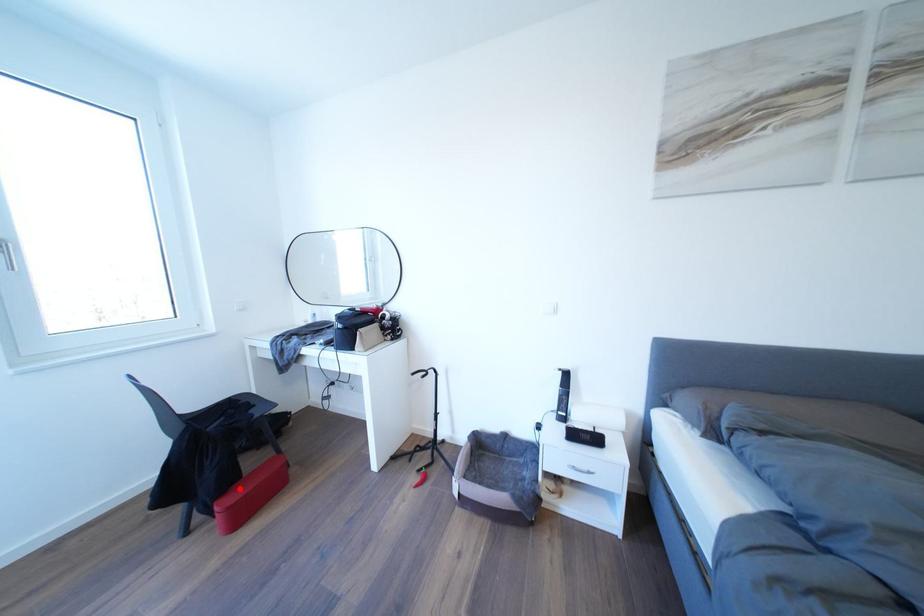
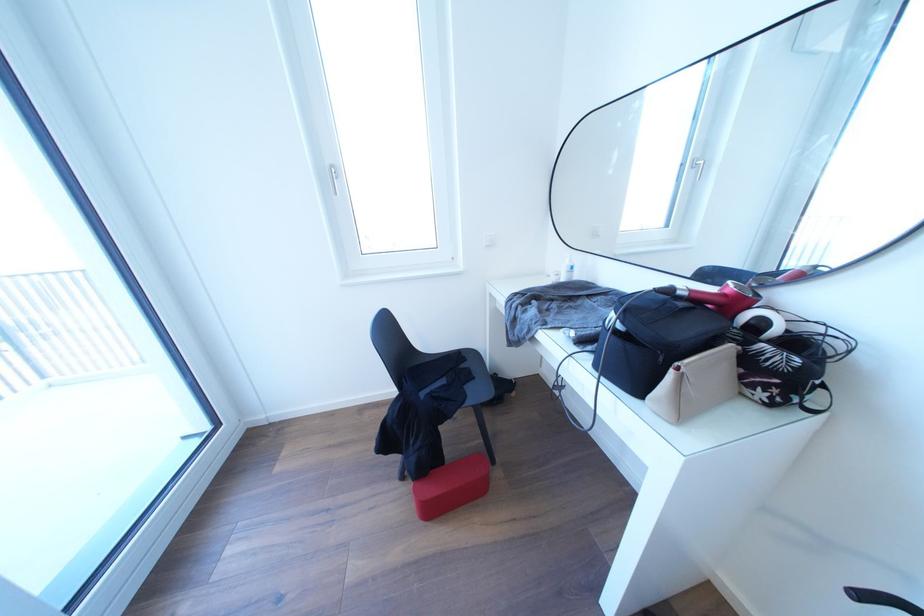
Where in the second image is the point corresponding to the highlighted location from the first image?

(441, 472)